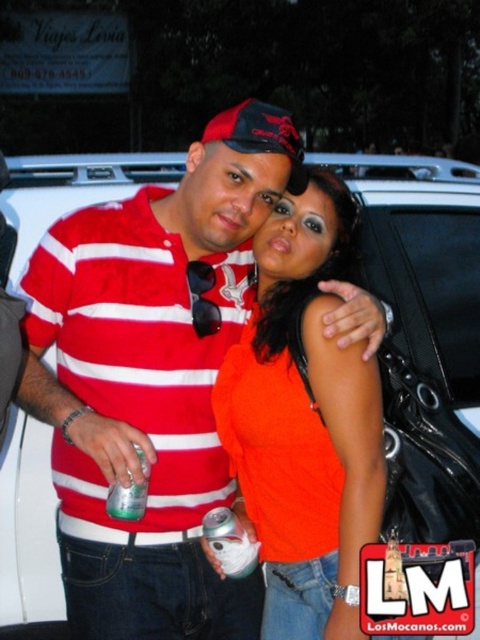
Image resolution: width=480 pixels, height=640 pixels. Identify the location of green matte can at center. (229, 541).

Which is below, green matte can at center or green translucent can at center?

green matte can at center

Is point (240, 564) closer to camera compared to point (121, 500)?

No, (240, 564) is behind (121, 500).

Find the location of a particular element. green matte can at center is located at coordinates (229, 541).

Does matte orange shirt at center have a lesser height compared to green translucent can at center?

Incorrect, matte orange shirt at center's height does not fall short of green translucent can at center's.

Does matte orange shirt at center have a lesser width compared to green translucent can at center?

Incorrect, matte orange shirt at center's width is not less than green translucent can at center's.

Measure the distance between point [372,516] and camera.

A distance of 1.58 meters exists between point [372,516] and camera.

In order to click on matte orange shirt at center in this screenshot , I will do `click(303, 424)`.

Is matte orange shirt at center thinner than green matte can at center?

No, matte orange shirt at center is not thinner than green matte can at center.

Does matte orange shirt at center appear on the left side of green matte can at center?

Incorrect, matte orange shirt at center is not on the left side of green matte can at center.

Image resolution: width=480 pixels, height=640 pixels. What do you see at coordinates (303, 424) in the screenshot?
I see `matte orange shirt at center` at bounding box center [303, 424].

Identify the location of matte orange shirt at center. (303, 424).